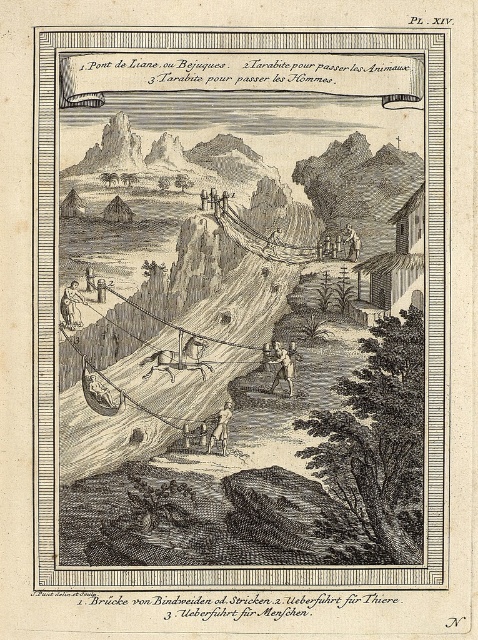
You are an explorer trying to cross the valley using the suspension bridges depicted in the image. There are two types of suspension bridges labeled as Tarabite for animals and Tarabite for humans. You notice a brown leather figure at lower center. Based on its position, which bridge is it likely standing on?

The brown leather figure at lower center is located at point (282, 368), which places it on the Tarabite pour passer les Hommes bridge, as that is the bridge designated for humans according to the labels provided.

You are an explorer trying to cross the valley using the bridge shown in the image. You see a light brown wood figure at lower left and a brown leather horse at center. How far apart are these two objects?

The light brown wood figure at lower left is 30.64 inches from the brown leather horse at center.

You are an explorer trying to cross the valley using the wire rope bridge at center and the wooden cart at center. Which object is nearer to you as you stand at the starting point?

The wire rope bridge at center is closer to the viewer than the wooden cart at center, so the wire rope bridge at center is nearer to you as you stand at the starting point.